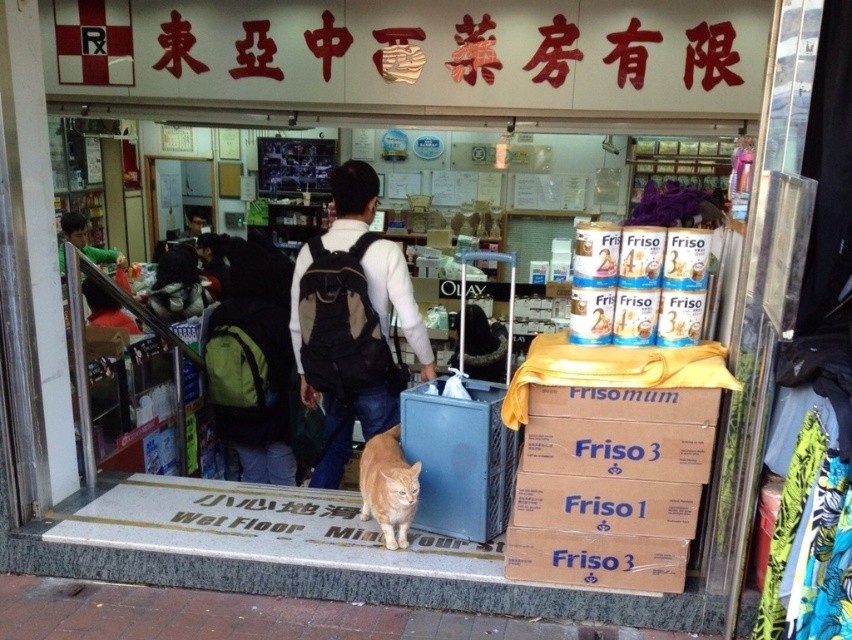
Can you confirm if dark brown backpack at center is bigger than green fabric shirt at upper left?

A: Yes, dark brown backpack at center is bigger than green fabric shirt at upper left.

Can you confirm if dark brown backpack at center is smaller than green fabric shirt at upper left?

No, dark brown backpack at center is not smaller than green fabric shirt at upper left.

This screenshot has width=852, height=640. What do you see at coordinates (337, 394) in the screenshot?
I see `dark brown backpack at center` at bounding box center [337, 394].

In order to click on dark brown backpack at center in this screenshot , I will do [337, 394].

Can you confirm if dark brown backpack at center is positioned below orange fur cat at center?

No.

Consider the image. Which is above, dark brown backpack at center or orange fur cat at center?

dark brown backpack at center

Is point (325, 481) less distant than point (394, 538)?

No, (325, 481) is behind (394, 538).

Where is `dark brown backpack at center`? This screenshot has height=640, width=852. dark brown backpack at center is located at coordinates (337, 394).

Where is `blue plastic crate at center`? blue plastic crate at center is located at coordinates (459, 458).

Is blue plastic crate at center taller than orange fur cat at center?

Correct, blue plastic crate at center is much taller as orange fur cat at center.

What do you see at coordinates (459, 458) in the screenshot? I see `blue plastic crate at center` at bounding box center [459, 458].

Locate an element on the screen. blue plastic crate at center is located at coordinates point(459,458).